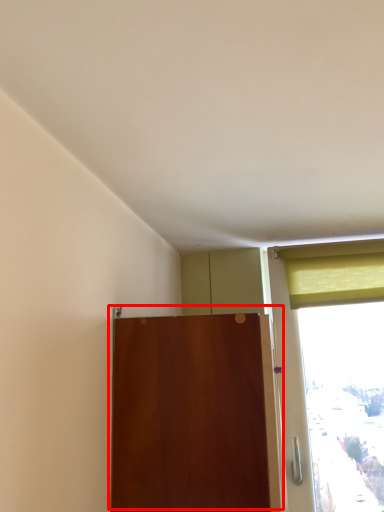
Question: From the image's perspective, what is the correct spatial relationship of door (annotated by the red box) in relation to curtain?

Choices:
 (A) above
 (B) below

Answer: (B)